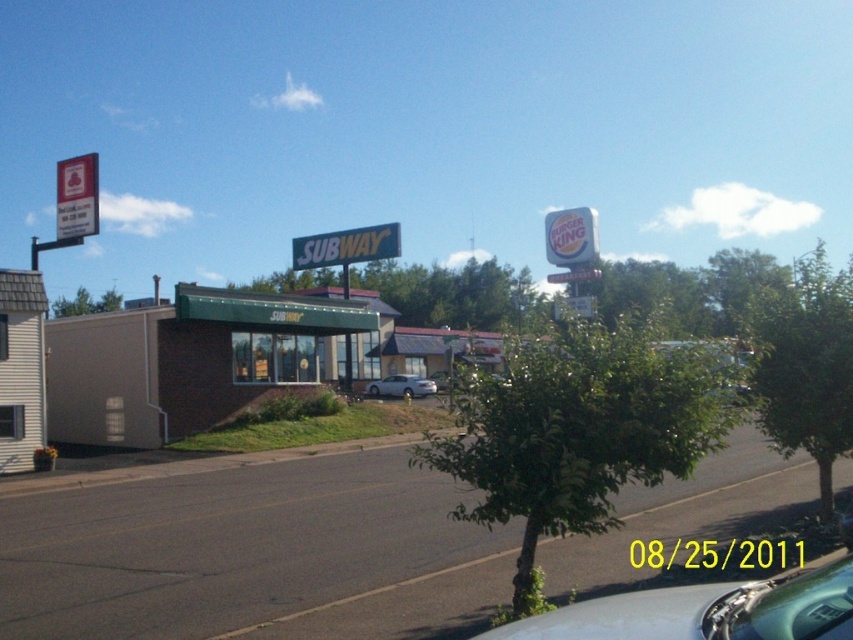
Question: Observing the image, what is the correct spatial positioning of blue plastic sign at center in reference to white plastic sign at upper center?

Choices:
 (A) above
 (B) below

Answer: (B)

Question: Does blue plastic sign at center have a smaller size compared to white matte sedan at center?

Choices:
 (A) no
 (B) yes

Answer: (A)

Question: Is blue plastic sign at center to the left of white plastic sign at upper left from the viewer's perspective?

Choices:
 (A) yes
 (B) no

Answer: (B)

Question: Which of these objects is positioned closest to the metallic silver car at center?

Choices:
 (A) blue plastic sign at center
 (B) white plastic sign at upper center
 (C) white plastic sign at upper left

Answer: (A)

Question: Estimate the real-world distances between objects in this image. Which object is farther from the white matte sedan at center?

Choices:
 (A) blue plastic sign at center
 (B) silver metallic sedan at center
 (C) metallic silver car at center

Answer: (A)

Question: Which of the following is the closest to the observer?

Choices:
 (A) white plastic sign at upper center
 (B) white plastic sign at upper left
 (C) white matte sedan at center
 (D) metallic silver car at center

Answer: (D)